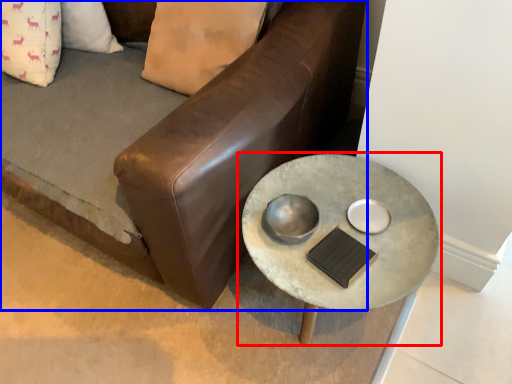
Question: Which point is closer to the camera, table (highlighted by a red box) or studio couch (highlighted by a blue box)?

Choices:
 (A) table
 (B) studio couch

Answer: (B)